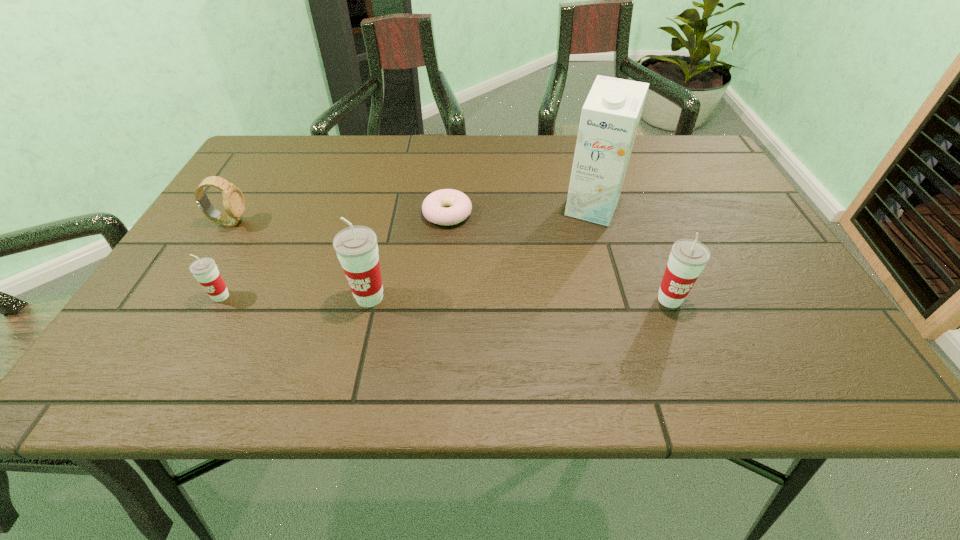
Locate an element on the screen. free space between the third object from left to right and the third tallest object is located at coordinates (519, 299).

Identify which object is located as the third nearest to the fifth object from right to left. Please provide its 2D coordinates. Your answer should be formatted as a tuple, i.e. [(x, y)], where the tuple contains the x and y coordinates of a point satisfying the conditions above.

[(459, 204)]

Choose which object is the second nearest neighbor to the second cup from right to left. Please provide its 2D coordinates. Your answer should be formatted as a tuple, i.e. [(x, y)], where the tuple contains the x and y coordinates of a point satisfying the conditions above.

[(204, 269)]

At what (x,y) coordinates should I click in order to perform the action: click on the closest cup to the third tallest object. Please return your answer as a coordinate pair (x, y). Looking at the image, I should click on (356, 246).

Point out which cup is positioned as the second nearest to the watch. Please provide its 2D coordinates. Your answer should be formatted as a tuple, i.e. [(x, y)], where the tuple contains the x and y coordinates of a point satisfying the conditions above.

[(356, 246)]

Find the location of a particular element. The height and width of the screenshot is (540, 960). vacant space that satisfies the following two spatial constraints: 1. on the front side of the carton; 2. on the face of the leftmost object is located at coordinates (595, 222).